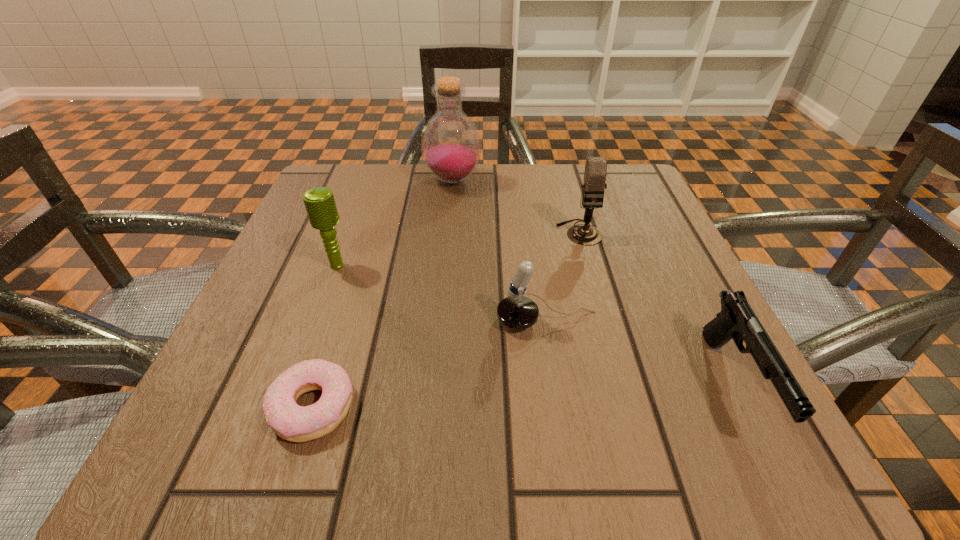
What are the coordinates of `gun present at the right edge` in the screenshot? It's located at (737, 321).

Find the location of a particular element. object that is positioned at the near left corner is located at coordinates (294, 423).

Identify the location of object situated at the far right corner. (595, 172).

Where is `object located at the near right corner`? The height and width of the screenshot is (540, 960). object located at the near right corner is located at coordinates (737, 321).

The height and width of the screenshot is (540, 960). In the image, there is a desktop. What are the coordinates of `vacant space at the far edge` in the screenshot? It's located at (396, 171).

What are the coordinates of `vacant space at the near edge of the desktop` in the screenshot? It's located at (412, 434).

You are a GUI agent. You are given a task and a screenshot of the screen. Output one action in this format:
    pyautogui.click(x=<x>, y=<y>)
    Task: Click on the vacant space at the left edge
    
    Given the screenshot: What is the action you would take?
    pyautogui.click(x=337, y=292)

At what (x,y) coordinates should I click in order to perform the action: click on free region at the right edge of the desktop. Please return your answer as a coordinate pair (x, y). This screenshot has height=540, width=960. Looking at the image, I should click on (680, 311).

Find the location of `free location at the far left corner of the desktop`. free location at the far left corner of the desktop is located at coordinates [324, 187].

I want to click on vacant region at the near left corner of the desktop, so click(199, 421).